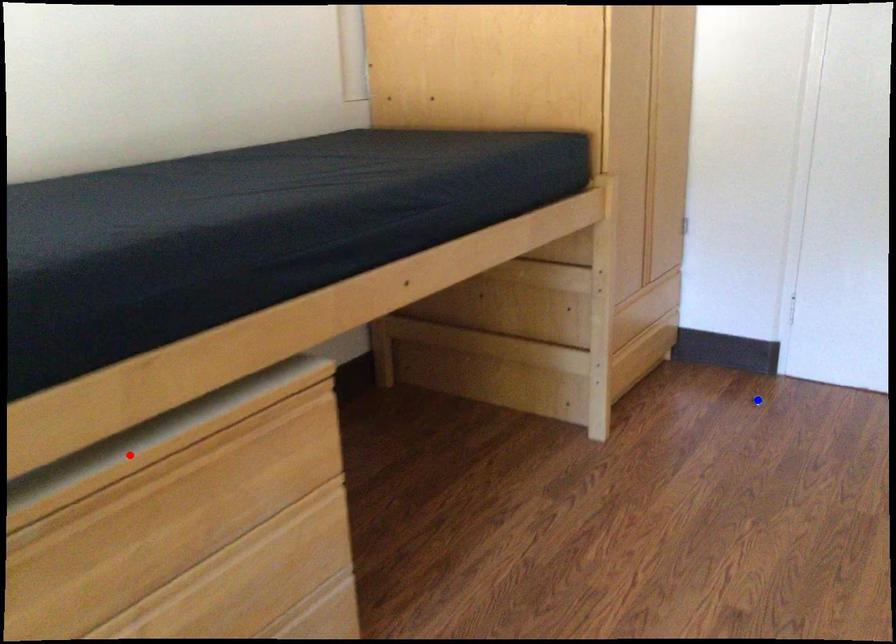
Question: Two points are marked on the image. Which point is closer to the camera?

Choices:
 (A) Blue point is closer.
 (B) Red point is closer.

Answer: (B)